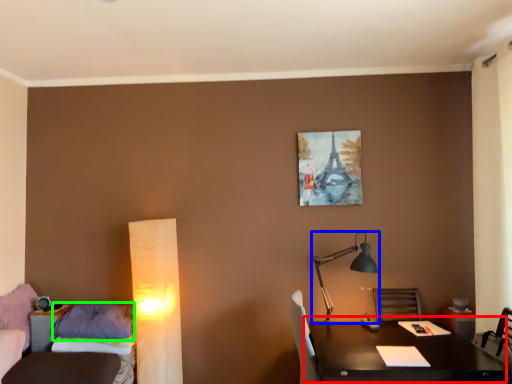
Question: Estimate the real-world distances between objects in this image. Which object is farther from table (highlighted by a red box), lamp (highlighted by a blue box) or pillow (highlighted by a green box)?

Choices:
 (A) lamp
 (B) pillow

Answer: (B)